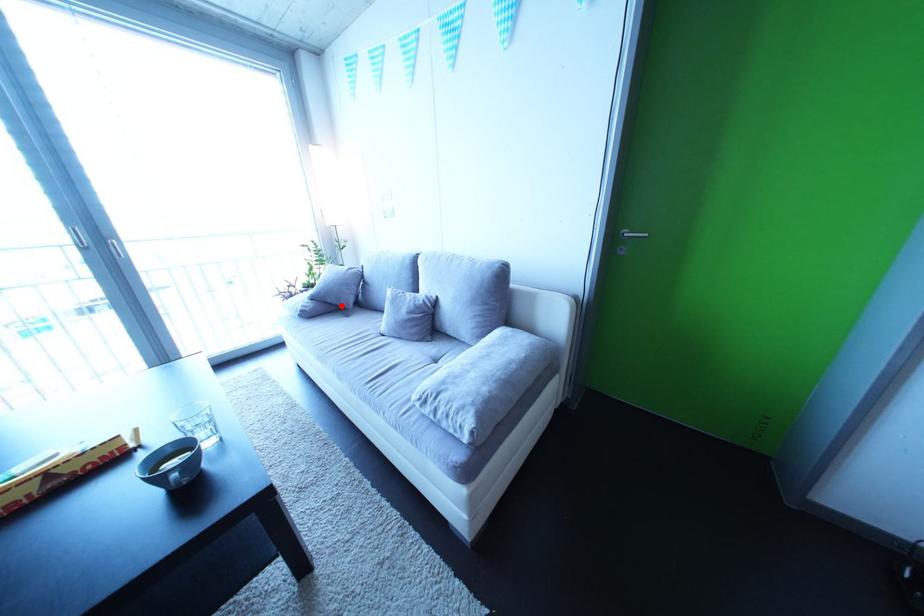
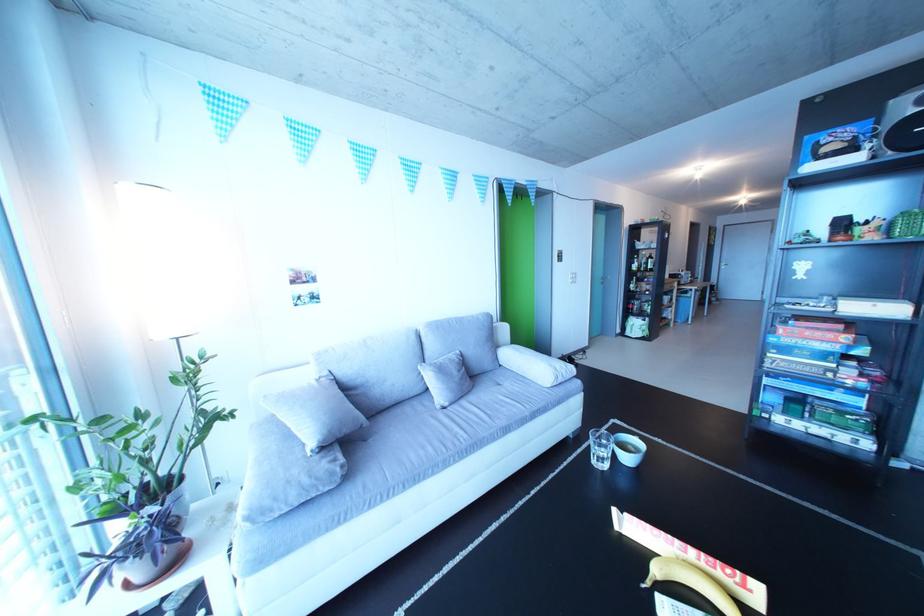
The point at the highlighted location is marked in the first image. Where is the corresponding point in the second image?

(359, 437)